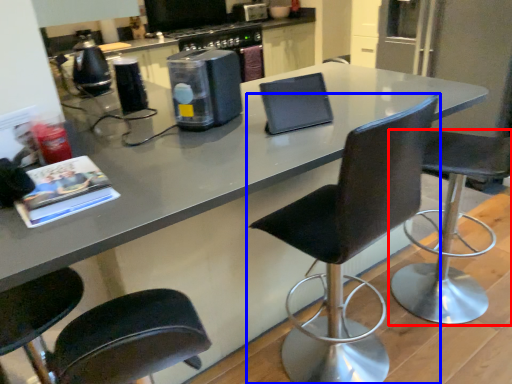
Question: Among these objects, which one is farthest to the camera, chair (highlighted by a red box) or chair (highlighted by a blue box)?

Choices:
 (A) chair
 (B) chair

Answer: (A)